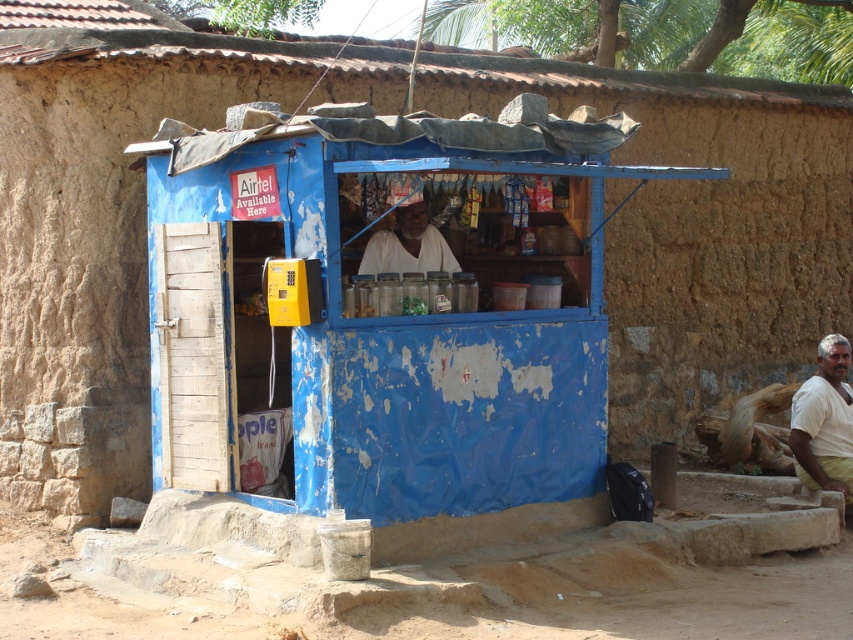
Who is higher up, white cotton shirt at lower right or white matte man at center?

white matte man at center is higher up.

Describe the element at coordinates (824, 420) in the screenshot. I see `white cotton shirt at lower right` at that location.

Locate an element on the screen. The width and height of the screenshot is (853, 640). white cotton shirt at lower right is located at coordinates (824, 420).